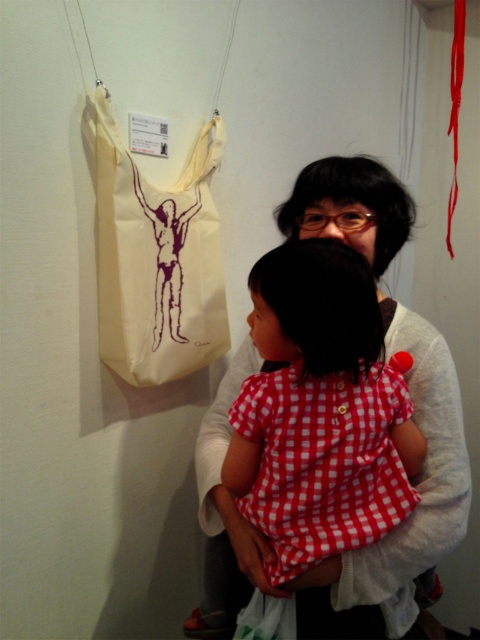
Does matte white cotton bag at upper left come behind off-white canvas tote at left?

No, matte white cotton bag at upper left is closer to the viewer.

Between matte white cotton bag at upper left and off-white canvas tote at left, which one appears on the left side from the viewer's perspective?

From the viewer's perspective, off-white canvas tote at left appears more on the left side.

Does point (230, 605) lie in front of point (210, 244)?

Yes, point (230, 605) is in front of point (210, 244).

The width and height of the screenshot is (480, 640). What are the coordinates of `matte white cotton bag at upper left` in the screenshot? It's located at (351, 550).